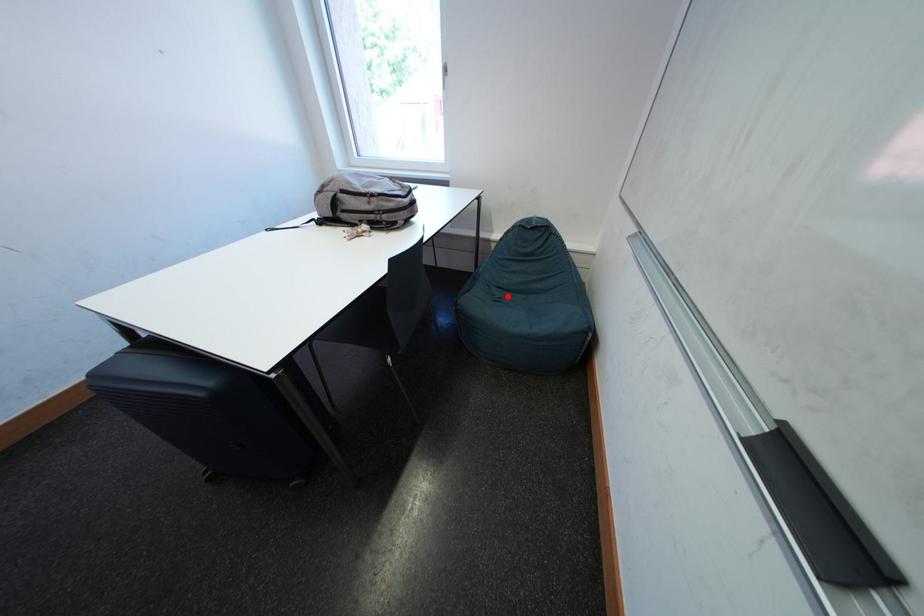
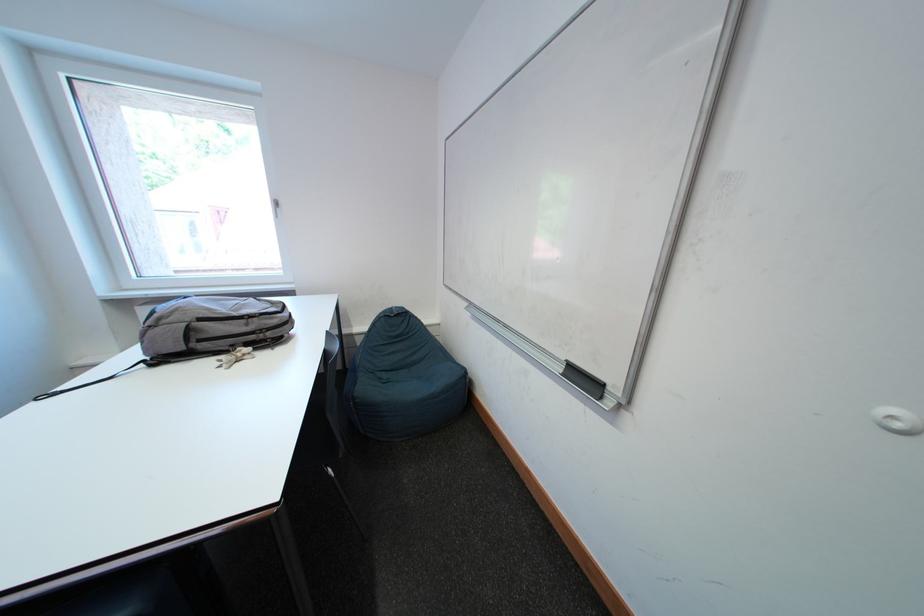
The point at the highlighted location is marked in the first image. Where is the corresponding point in the second image?

(394, 379)